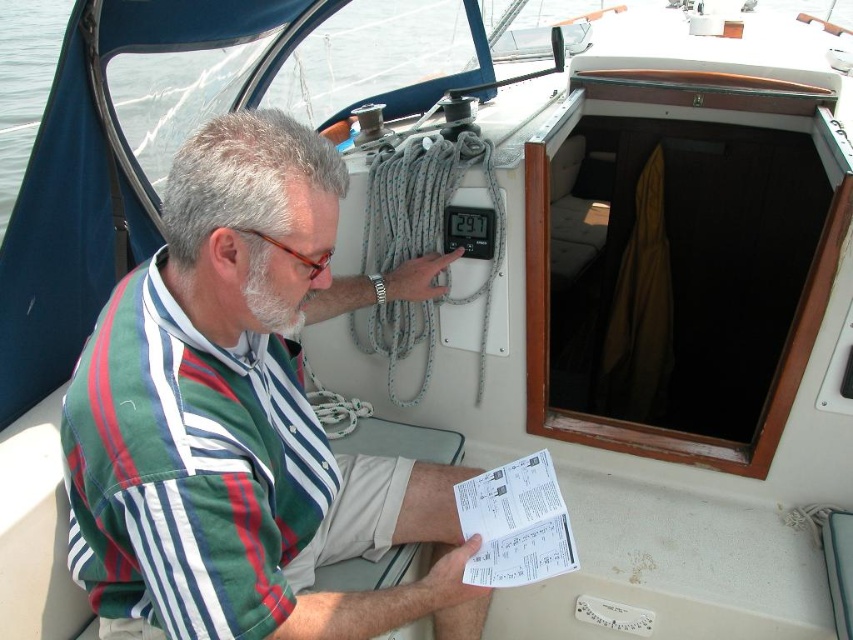
Is point (260, 328) farther from camera compared to point (556, 531)?

No, it is not.

Where is `green striped shirt at center`? This screenshot has width=853, height=640. green striped shirt at center is located at coordinates (242, 419).

Who is more forward, (271, 113) or (540, 483)?

Point (271, 113) is in front.

The width and height of the screenshot is (853, 640). I want to click on green striped shirt at center, so [242, 419].